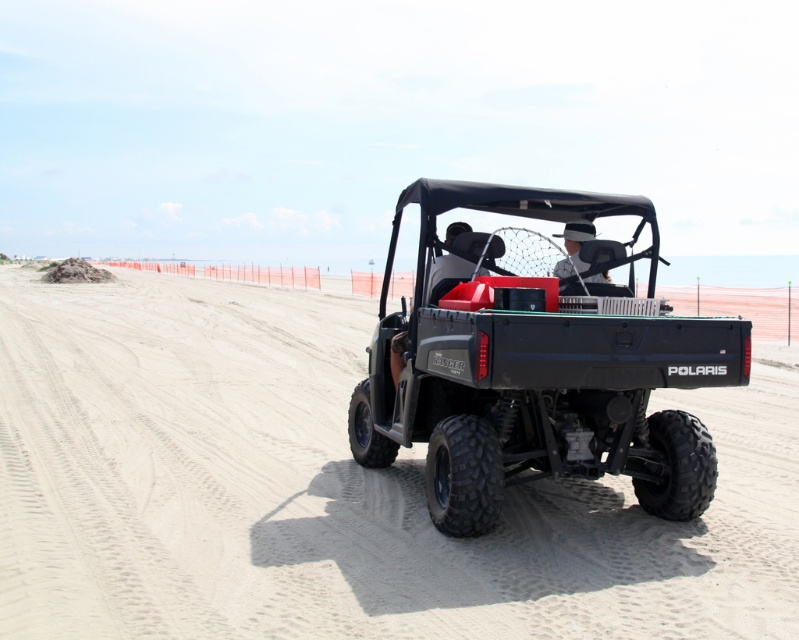
Where is `sandy dirt track at center`? sandy dirt track at center is located at coordinates (332, 490).

Can you confirm if sandy dirt track at center is taller than matte black utility vehicle at center?

No.

Which is in front, point (348, 504) or point (684, 380)?

Point (684, 380) is in front.

Locate an element on the screen. This screenshot has height=640, width=799. sandy dirt track at center is located at coordinates pyautogui.click(x=332, y=490).

Find the location of `sandy dirt track at center`. sandy dirt track at center is located at coordinates (332, 490).

Is point (14, 292) more distant than point (578, 228)?

That is True.

Image resolution: width=799 pixels, height=640 pixels. What do you see at coordinates (332, 490) in the screenshot? I see `sandy dirt track at center` at bounding box center [332, 490].

Identify the location of sandy dirt track at center. Image resolution: width=799 pixels, height=640 pixels. 332,490.

Is matte black utility vehicle at center above white fabric hat at center?

Actually, matte black utility vehicle at center is below white fabric hat at center.

Can you confirm if matte black utility vehicle at center is positioned to the right of white fabric hat at center?

No, matte black utility vehicle at center is not to the right of white fabric hat at center.

Identify the location of matte black utility vehicle at center. The width and height of the screenshot is (799, 640). (535, 364).

The image size is (799, 640). Find the location of `matte black utility vehicle at center`. matte black utility vehicle at center is located at coordinates pos(535,364).